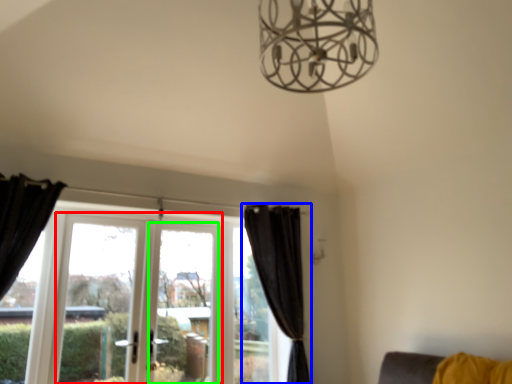
Question: Which object is positioned closest to screen door (highlighted by a red box)? Select from curtain (highlighted by a blue box) and window screen (highlighted by a green box).

Choices:
 (A) curtain
 (B) window screen

Answer: (B)